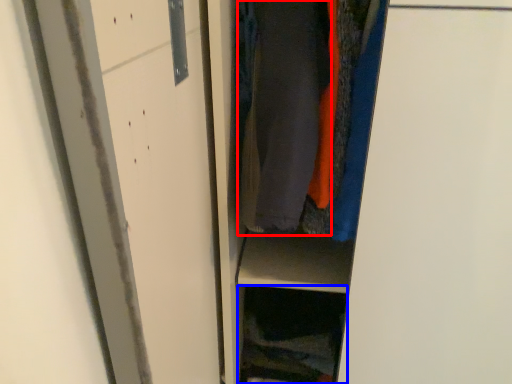
Question: Which point is closer to the camera, garment (highlighted by a red box) or cabinet (highlighted by a blue box)?

Choices:
 (A) garment
 (B) cabinet

Answer: (A)